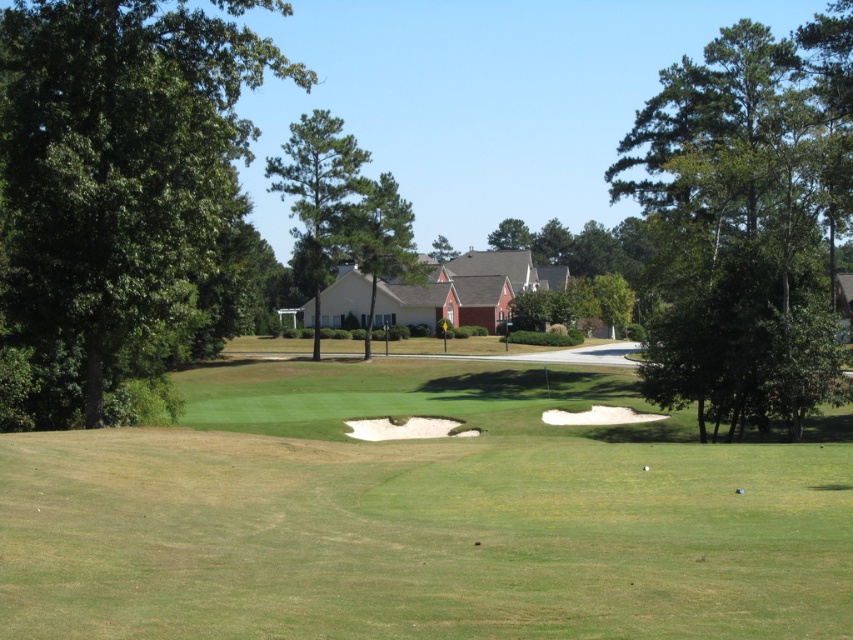
Question: Estimate the real-world distances between objects in this image. Which object is farther from the green leafy tree at left?

Choices:
 (A) green leafy tree at upper right
 (B) white matte golf ball at center
 (C) green grassy golf course at center

Answer: (A)

Question: Which point is farther from the camera taking this photo?

Choices:
 (A) (374, 300)
 (B) (161, 332)
 (C) (433, 248)
 (D) (221, 538)

Answer: (C)

Question: In this image, where is green leafy tree at left located relative to white sand trap at center?

Choices:
 (A) below
 (B) above

Answer: (B)

Question: Where is green textured pine tree at center located in relation to green textured tree at center in the image?

Choices:
 (A) below
 (B) above

Answer: (B)

Question: Which object appears farthest from the camera in this image?

Choices:
 (A) green grassy golf course at center
 (B) green leafy tree at upper right
 (C) green textured tree at center
 (D) white matte golf ball at center

Answer: (C)

Question: In this image, where is green textured tree at center located relative to white matte golf ball at center?

Choices:
 (A) above
 (B) below

Answer: (A)